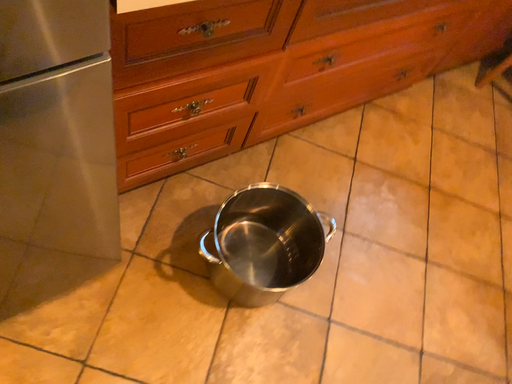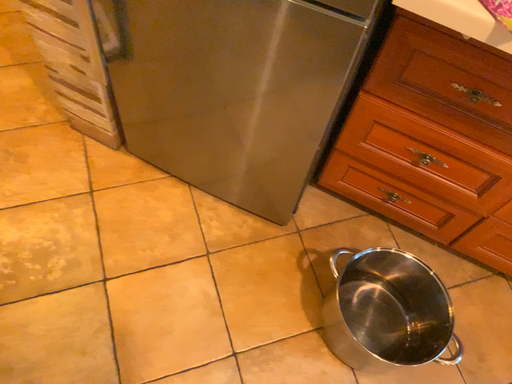
Question: Which way did the camera rotate in the video?

Choices:
 (A) rotated left
 (B) rotated right

Answer: (A)